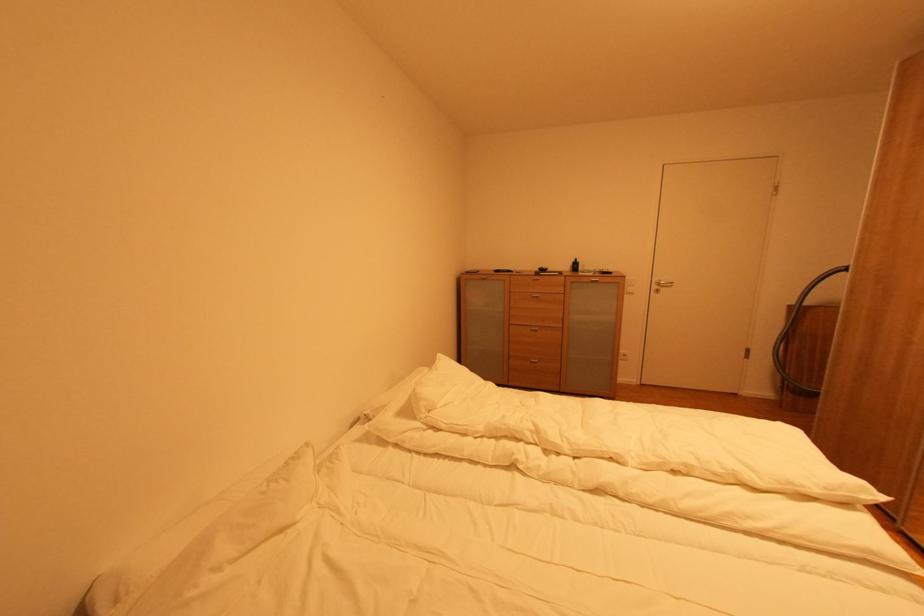
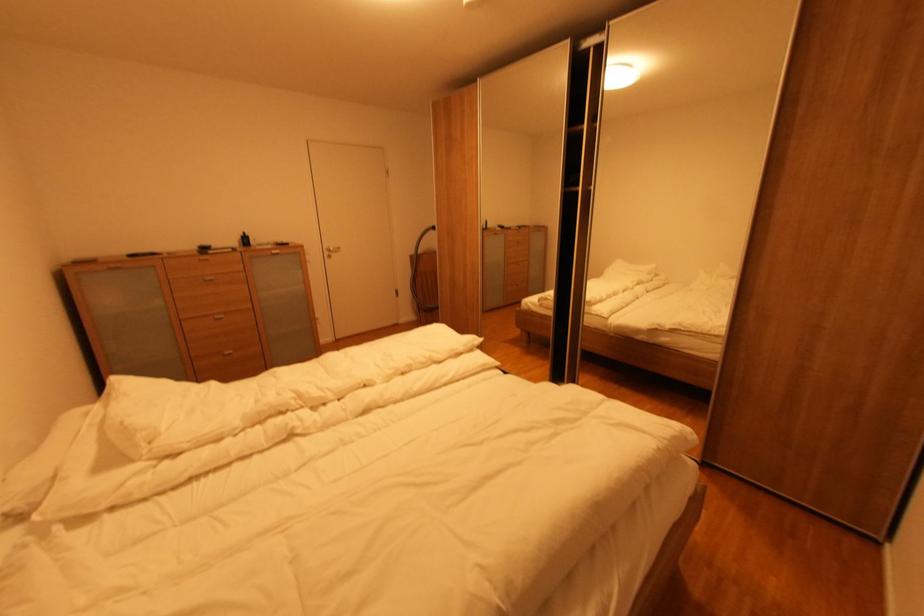
The point at (579, 262) is marked in the first image. Where is the corresponding point in the second image?

(248, 237)